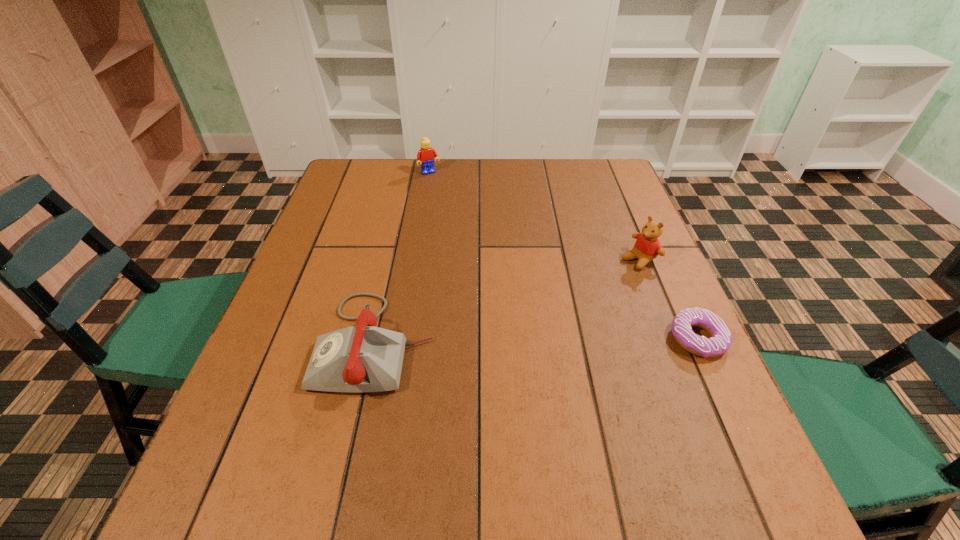
Locate an element on the screen. This screenshot has width=960, height=540. vacant spot on the desktop that is between the telephone and the doughnut and is positioned on the front-facing side of the farthest object is located at coordinates (534, 341).

Where is `free space on the desktop that is between the third tallest object and the doughnut and is positioned on the front-facing side of the teddy bear`? free space on the desktop that is between the third tallest object and the doughnut and is positioned on the front-facing side of the teddy bear is located at coordinates (494, 341).